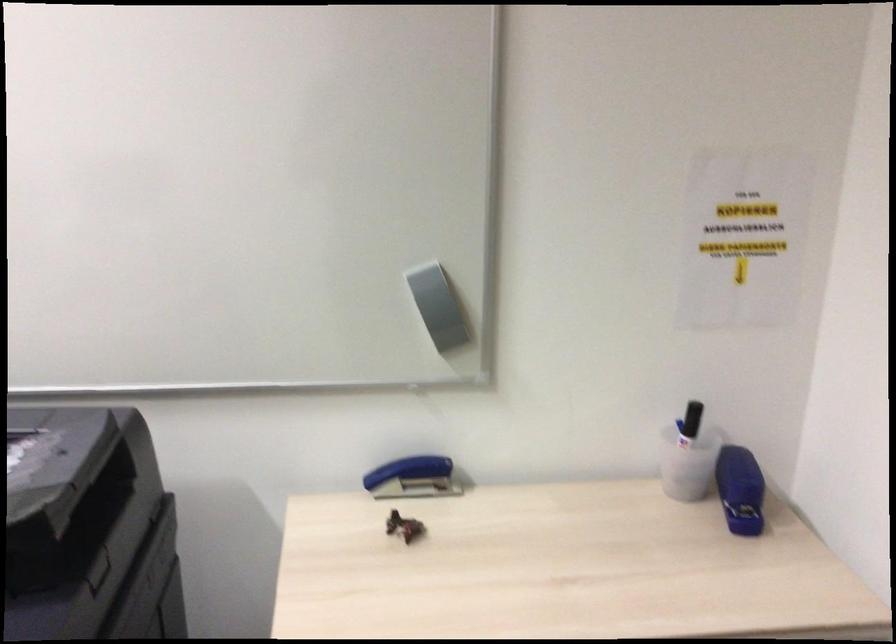
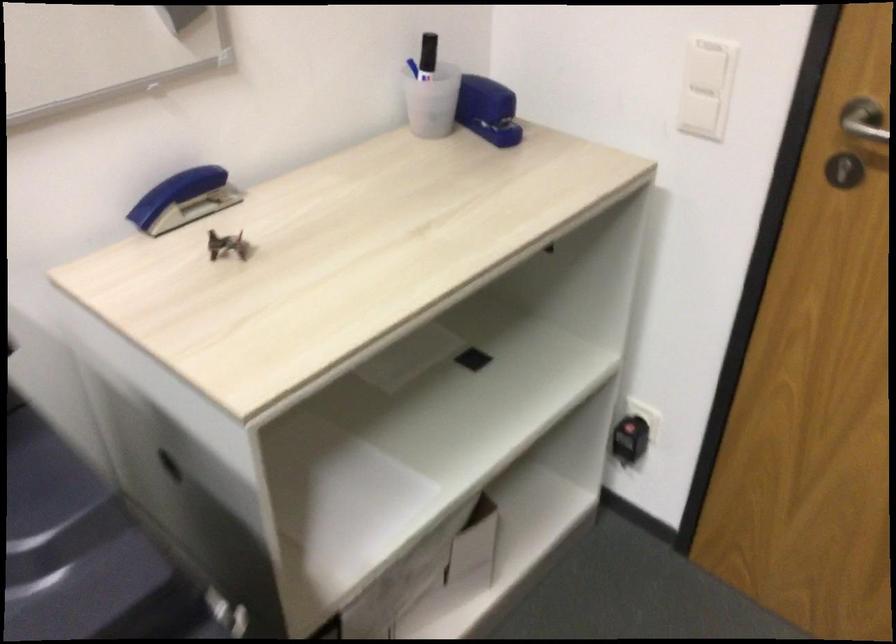
In the second image, find the point that corresponds to (679,460) in the first image.

(428, 102)